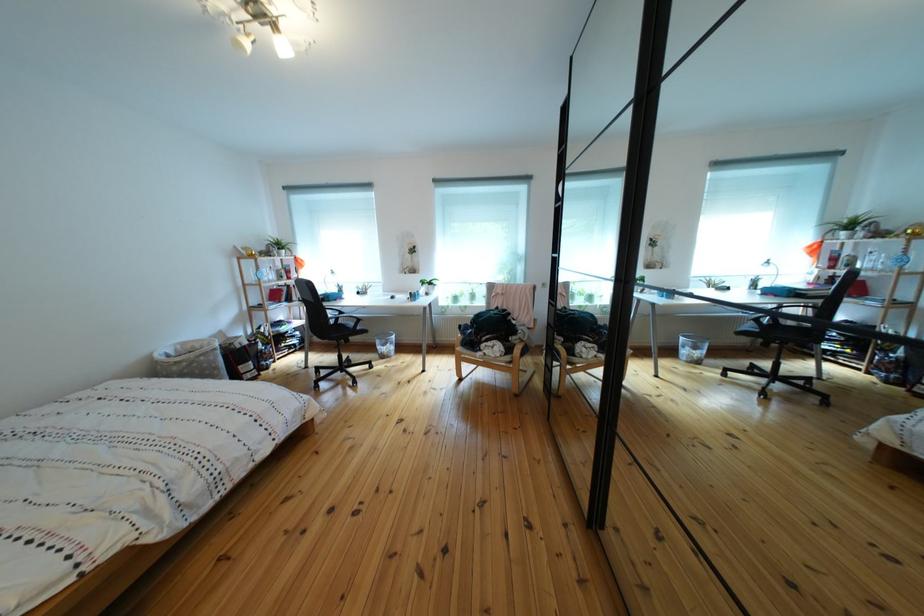
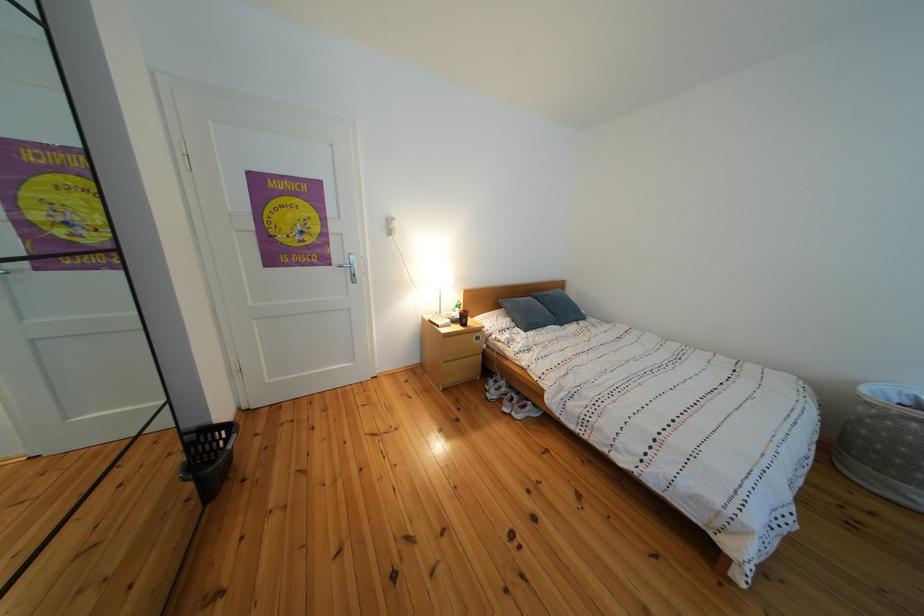
In the second image, find the point that corresponds to [172,363] in the first image.

(890, 398)